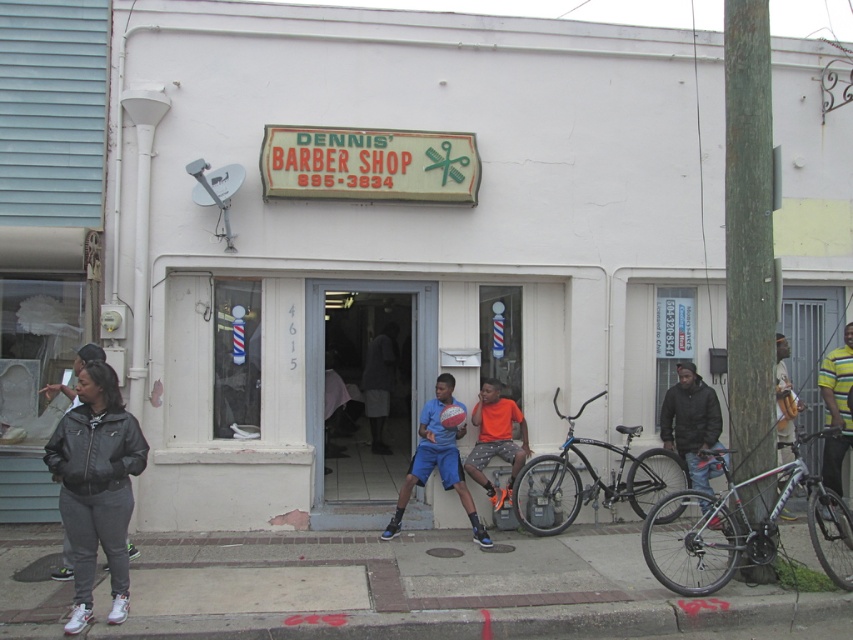
Can you confirm if orange cotton shirt at center is shorter than yellow striped shirt at upper right?

Indeed, orange cotton shirt at center has a lesser height compared to yellow striped shirt at upper right.

This screenshot has width=853, height=640. Describe the element at coordinates (496, 440) in the screenshot. I see `orange cotton shirt at center` at that location.

Image resolution: width=853 pixels, height=640 pixels. Find the location of `orange cotton shirt at center`. orange cotton shirt at center is located at coordinates (496, 440).

Between white matte storefront at center and black matte bicycle at right, which one has more height?

black matte bicycle at right is taller.

Can you confirm if white matte storefront at center is positioned above black matte bicycle at right?

Correct, white matte storefront at center is located above black matte bicycle at right.

Is point (500, 58) closer to camera compared to point (527, 506)?

No, (500, 58) is behind (527, 506).

Locate an element on the screen. The height and width of the screenshot is (640, 853). white matte storefront at center is located at coordinates (397, 236).

Between point (355, 109) and point (640, 593), which one is positioned behind?

Positioned behind is point (355, 109).

Between white matte storefront at center and concrete sidewalk at lower center, which one is positioned lower?

concrete sidewalk at lower center

Is point (323, 200) positioned in front of point (190, 621)?

No, (323, 200) is behind (190, 621).

I want to click on white matte storefront at center, so click(x=397, y=236).